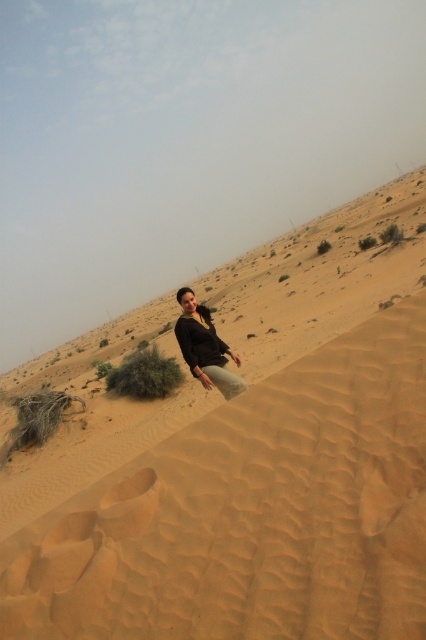
Question: Can you confirm if sandy textured desert at center is wider than matte black top at center?

Choices:
 (A) yes
 (B) no

Answer: (A)

Question: Can you confirm if sandy textured desert at center is positioned to the left of matte black top at center?

Choices:
 (A) yes
 (B) no

Answer: (B)

Question: Which point is closer to the camera?

Choices:
 (A) (204, 317)
 (B) (374, 577)

Answer: (B)

Question: Is sandy textured desert at center positioned behind matte black top at center?

Choices:
 (A) yes
 (B) no

Answer: (B)

Question: Which point is farther to the camera?

Choices:
 (A) matte black top at center
 (B) sandy textured desert at center

Answer: (A)